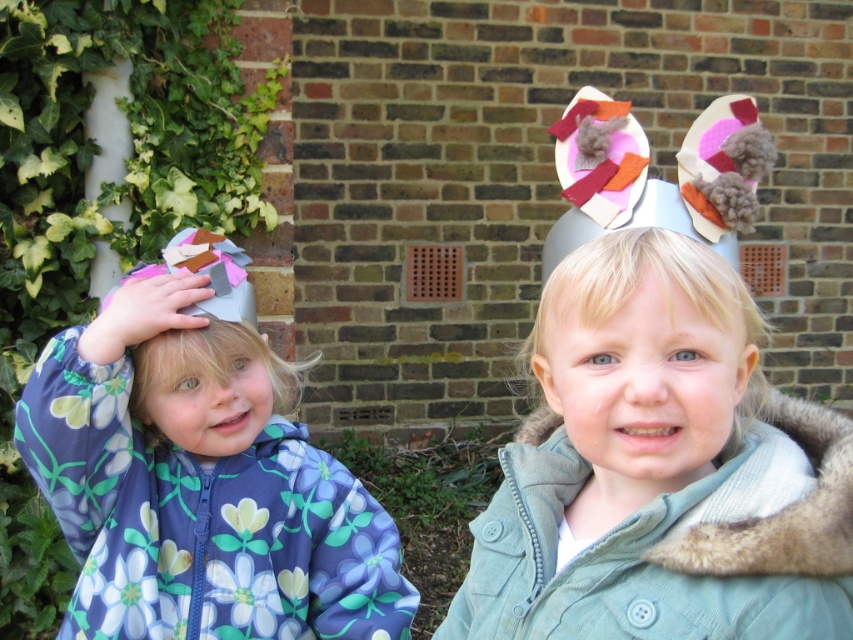
Question: Which point is farther to the camera?

Choices:
 (A) fluffy white hat at left
 (B) light green corduroy jacket at center

Answer: (A)

Question: Can you confirm if floral fabric jacket at left is positioned to the left of fuzzy gray hat at center?

Choices:
 (A) no
 (B) yes

Answer: (B)

Question: In this image, where is light green corduroy jacket at center located relative to fuzzy gray hat at center?

Choices:
 (A) above
 (B) below

Answer: (B)

Question: Which point is closer to the camera?

Choices:
 (A) (627, 525)
 (B) (164, 396)
 (C) (610, 316)

Answer: (C)

Question: Which point is farther to the camera?

Choices:
 (A) floral fabric jacket at left
 (B) fluffy white hat at left

Answer: (B)

Question: Can you confirm if floral fabric jacket at left is bigger than fluffy white hat at left?

Choices:
 (A) yes
 (B) no

Answer: (A)